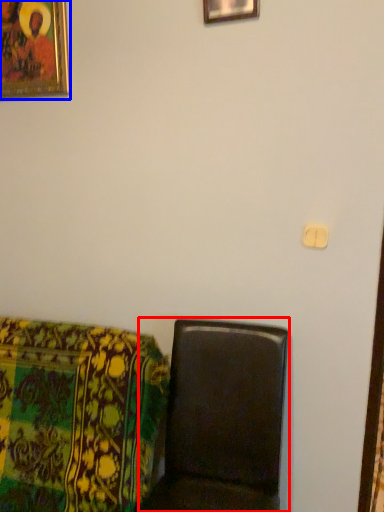
Question: Which of the following is the closest to the observer, furniture (highlighted by a red box) or picture frame (highlighted by a blue box)?

Choices:
 (A) furniture
 (B) picture frame

Answer: (A)